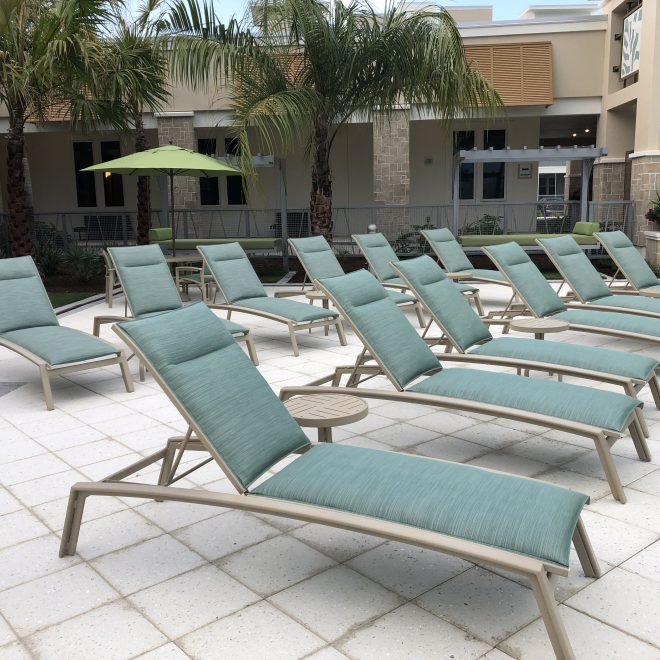
In order to click on wall in this screenshot , I will do `click(436, 178)`.